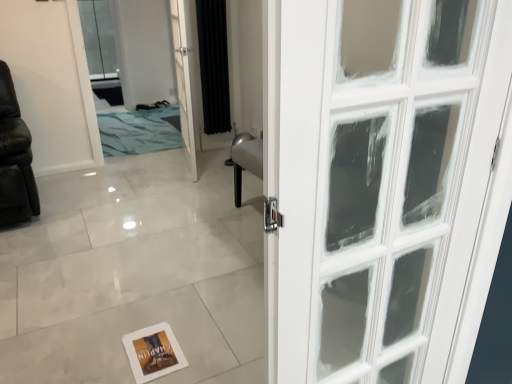
Question: Considering the positions of point (179, 38) and point (104, 72), is point (179, 38) closer or farther from the camera than point (104, 72)?

Choices:
 (A) farther
 (B) closer

Answer: (B)

Question: Considering the relative positions of white glass door at center and clear glass window at upper left in the image provided, is white glass door at center to the left or to the right of clear glass window at upper left?

Choices:
 (A) left
 (B) right

Answer: (B)

Question: Which object is positioned closest to the black fabric curtain at center?

Choices:
 (A) blue fabric bed at upper left
 (B) clear glass window at upper left
 (C) white glass door at center
 (D) white paper postcard at lower center

Answer: (C)

Question: Which object is positioned farthest from the blue fabric bed at upper left?

Choices:
 (A) clear glass window at upper left
 (B) black fabric curtain at center
 (C) white glass door at center
 (D) white paper postcard at lower center

Answer: (D)